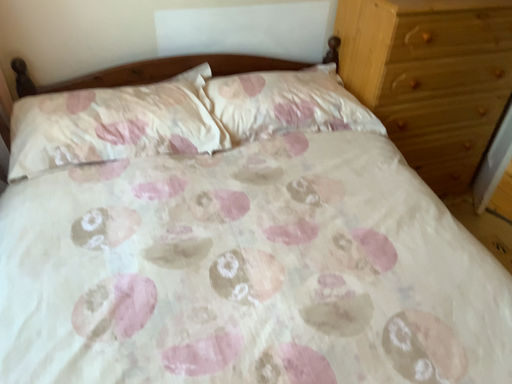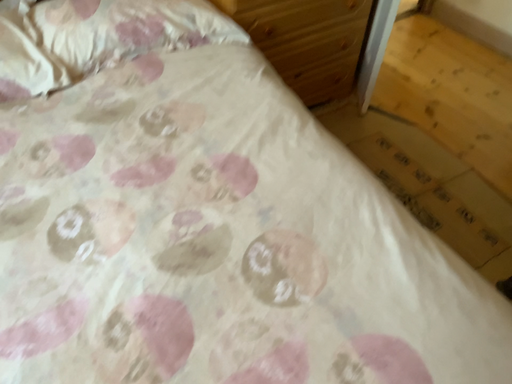
Question: How did the camera likely rotate when shooting the video?

Choices:
 (A) rotated upward
 (B) rotated downward

Answer: (B)